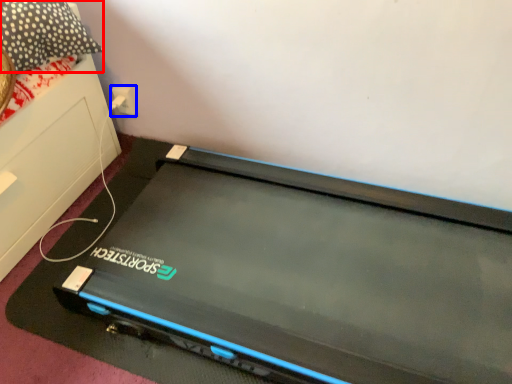
Question: Which of the following is the farthest to the observer, pillow (highlighted by a red box) or electric outlet (highlighted by a blue box)?

Choices:
 (A) pillow
 (B) electric outlet

Answer: (B)